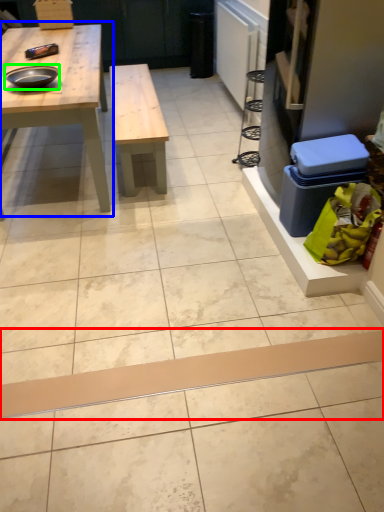
Question: Which object is positioned closest to plank (highlighted by a red box)? Select from table (highlighted by a blue box) and tray (highlighted by a green box).

Choices:
 (A) table
 (B) tray

Answer: (A)